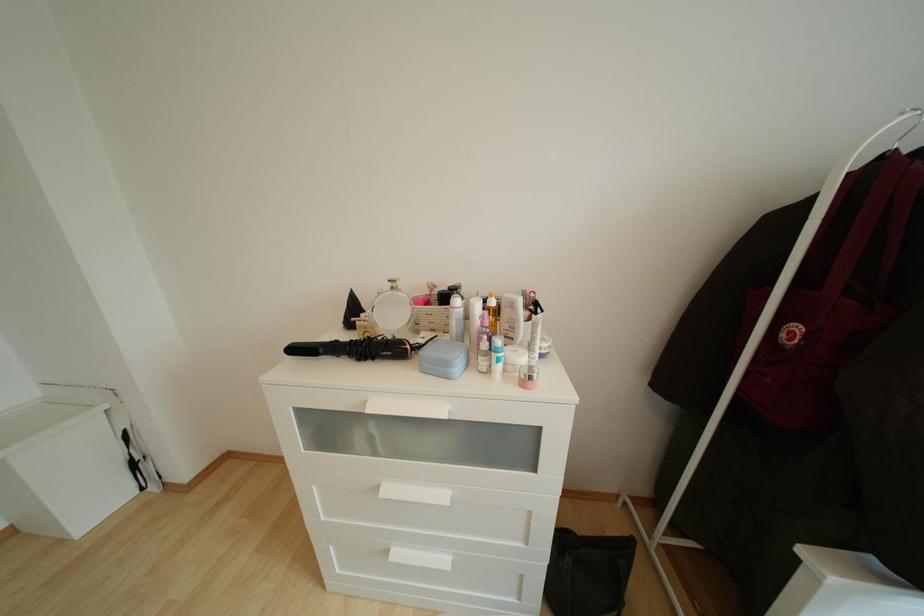
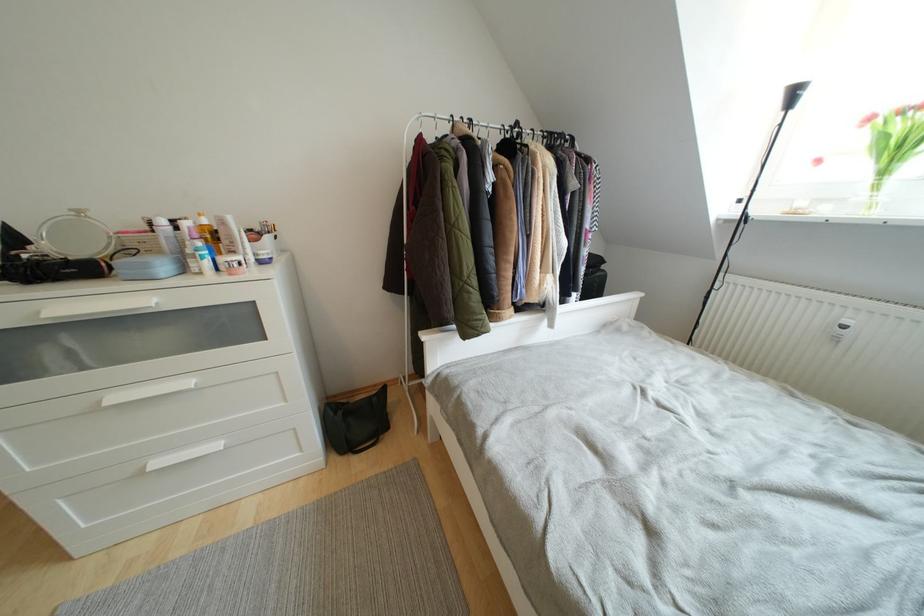
The point at (402,559) is marked in the first image. Where is the corresponding point in the second image?

(162, 467)